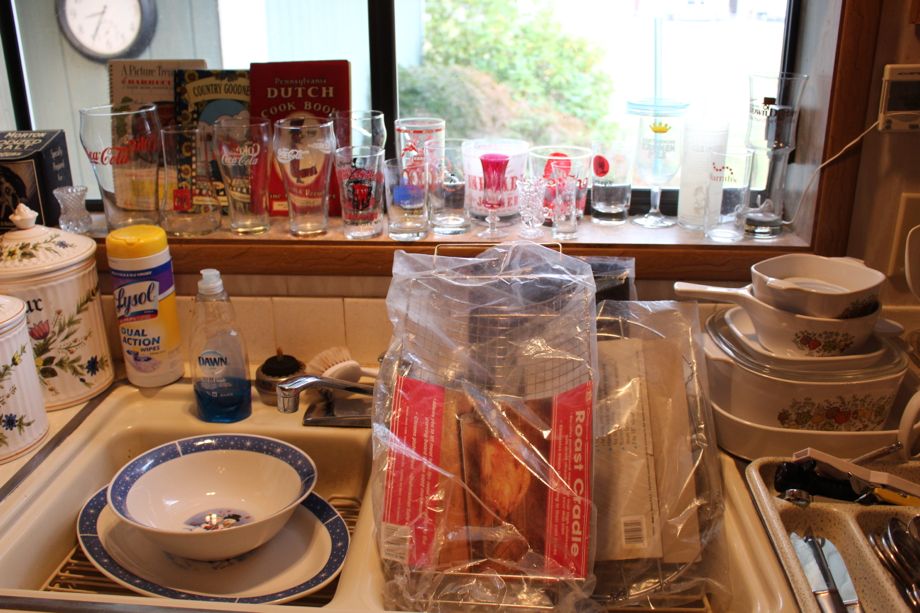
You are a GUI agent. You are given a task and a screenshot of the screen. Output one action in this format:
    pyautogui.click(x=<x>, y=<y>)
    Task: Click on the bowl
    The width and height of the screenshot is (920, 613).
    Given the screenshot: What is the action you would take?
    pyautogui.click(x=236, y=518)